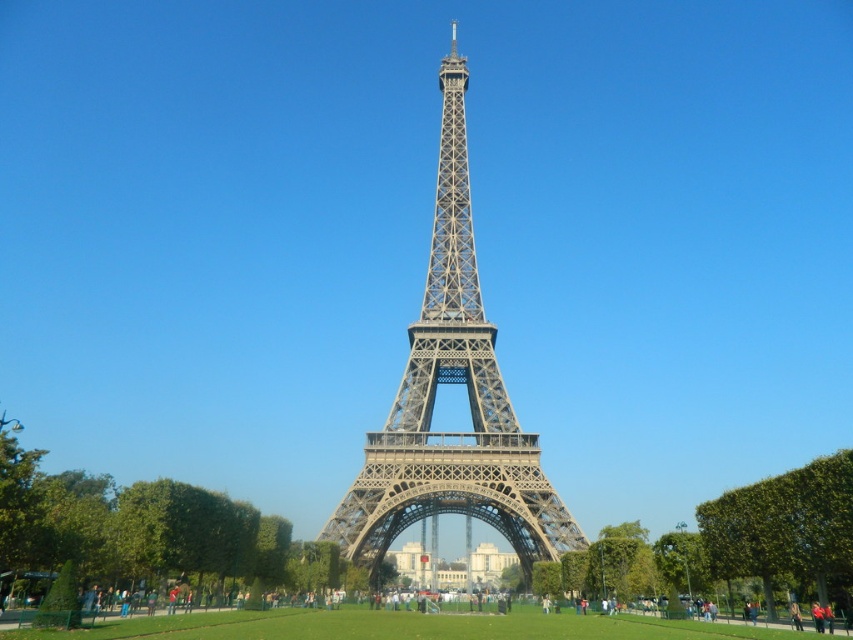
Question: Is metallic gray eiffel tower at center in front of green leafy tree at lower left?

Choices:
 (A) no
 (B) yes

Answer: (B)

Question: Among these points, which one is farthest from the camera?

Choices:
 (A) (392, 417)
 (B) (236, 636)

Answer: (A)

Question: Which point is farther to the camera?

Choices:
 (A) green leafy tree at lower left
 (B) green grass at center

Answer: (A)

Question: Is green leafy tree at lower left thinner than green grass at center?

Choices:
 (A) no
 (B) yes

Answer: (B)

Question: Which object is farther from the camera taking this photo?

Choices:
 (A) metallic gray eiffel tower at center
 (B) green grass at center
 (C) green leafy tree at lower left
 (D) green leafy tree at center

Answer: (C)

Question: Where is green leafy tree at center located in relation to green grass at center in the image?

Choices:
 (A) below
 (B) above

Answer: (B)